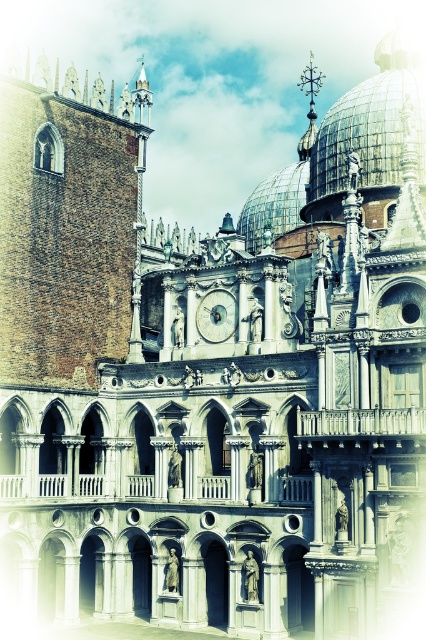
Is point (382, 106) positioned after point (219, 337)?

Yes, it is.

Identify the location of shiny silver dome at upper right. The image size is (426, 640). (368, 134).